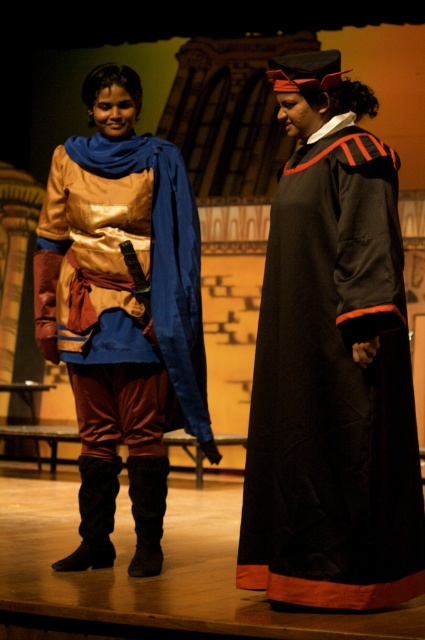
You are a costume designer preparing for a play. You need to ensure that all costumes are visible to the audience. Based on the image, which costume, the black velvet gown at right or the shiny gold tunic at center, would be more likely to catch the audience members attention from the back row?

The shiny gold tunic at center would be more likely to catch the audience members attention from the back row because it is shinier and more reflective than the black velvet gown at right.

You are a camera operator trying to focus on two specific points on the stage. The first point is at coordinates point (368, 445) and the second is at point (71, 156). Which point should you adjust your focus to first if you want to capture the closer one?

Point (368, 445) is closer to the camera than point (71, 156), so you should focus on point (368, 445) first.

You are a stagehand setting up for a play. You need to place a large prop that requires 3 square meters of space. You see the black velvet gown at right and the shiny gold tunic at center. Which object can accommodate the prop without overlapping?

The shiny gold tunic at center can accommodate the prop since it occupies more space than the black velvet gown at right.